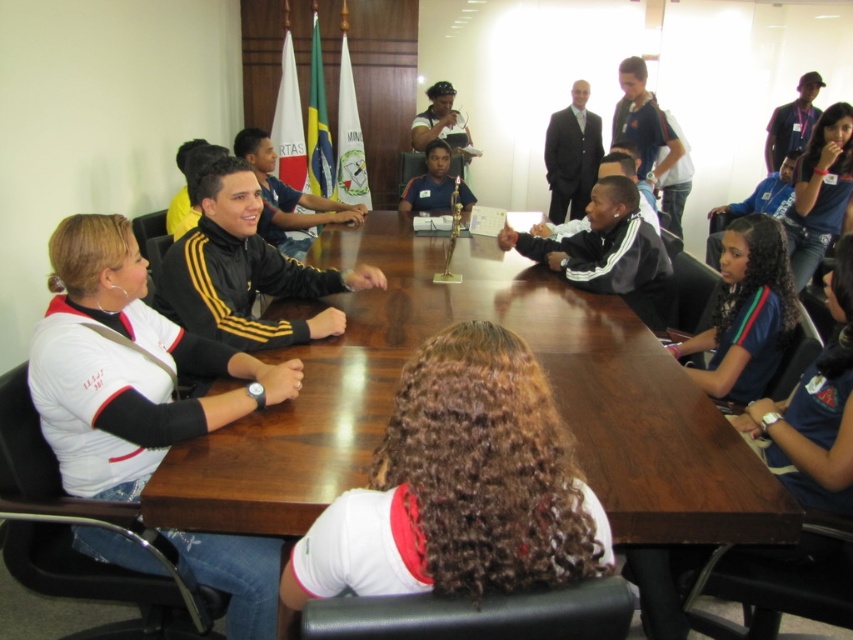
You are a photographer in the room and want to take a photo of the black adidas jacket at center and the matte black cap at upper center. Which object should you focus on first if you want to capture both in one shot without moving the camera?

You should focus on the black adidas jacket at center first because it is positioned under the matte black cap at upper center, so adjusting focus to the lower object will ensure both are in frame.

You are attending a meeting in this room and need to place a small notebook on the table. Where should you put it so that it is closest to the black adidas jacket at center?

The black adidas jacket at center is located at point [244,269], so placing the notebook near that coordinate would ensure it is closest to the jacket.